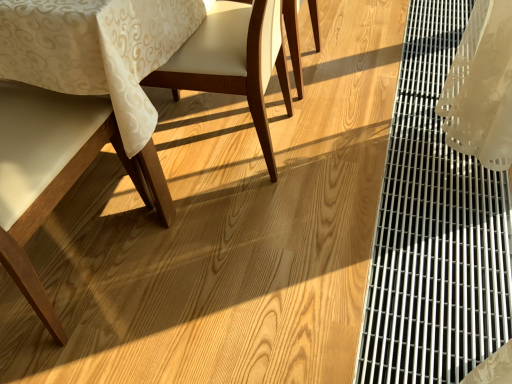
Locate an element on the screen. This screenshot has width=512, height=384. vacant location below metallic grid at right (from a real-world perspective) is located at coordinates (437, 183).